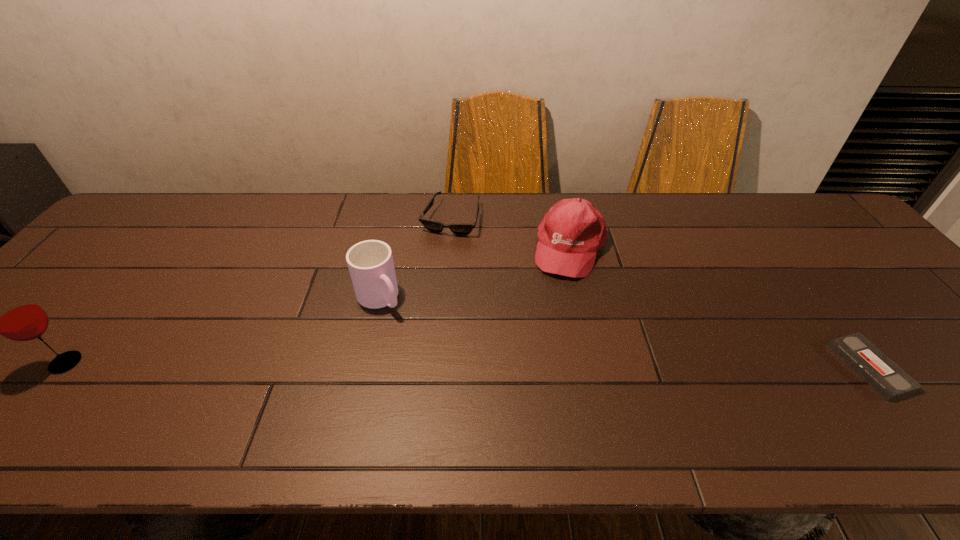
Locate an element on the screen. The width and height of the screenshot is (960, 540). free space that is in between the sunglasses and the second object from right to left is located at coordinates (510, 233).

Locate an element on the screen. The height and width of the screenshot is (540, 960). the third closest object to the fourth object from left to right is located at coordinates (878, 370).

Select which object is the fourth closest to the second shortest object. Please provide its 2D coordinates. Your answer should be formatted as a tuple, i.e. [(x, y)], where the tuple contains the x and y coordinates of a point satisfying the conditions above.

[(878, 370)]

Identify the location of free location that satisfies the following two spatial constraints: 1. on the back side of the baseball cap; 2. on the left side of the second object from left to right. (391, 247).

This screenshot has width=960, height=540. I want to click on vacant space that satisfies the following two spatial constraints: 1. on the back side of the leftmost object; 2. on the right side of the fourth object from left to right, so click(159, 247).

Find the location of a particular element. vacant area in the image that satisfies the following two spatial constraints: 1. on the front side of the fourth object from left to right; 2. on the left side of the fourth tallest object is located at coordinates (448, 247).

What are the coordinates of `free space in the image that satisfies the following two spatial constraints: 1. on the front side of the baseball cap; 2. on the right side of the rightmost object` in the screenshot? It's located at (596, 367).

In order to click on free space that satisfies the following two spatial constraints: 1. on the front side of the sunglasses; 2. on the left side of the fourth object from left to right in this screenshot , I will do `click(448, 247)`.